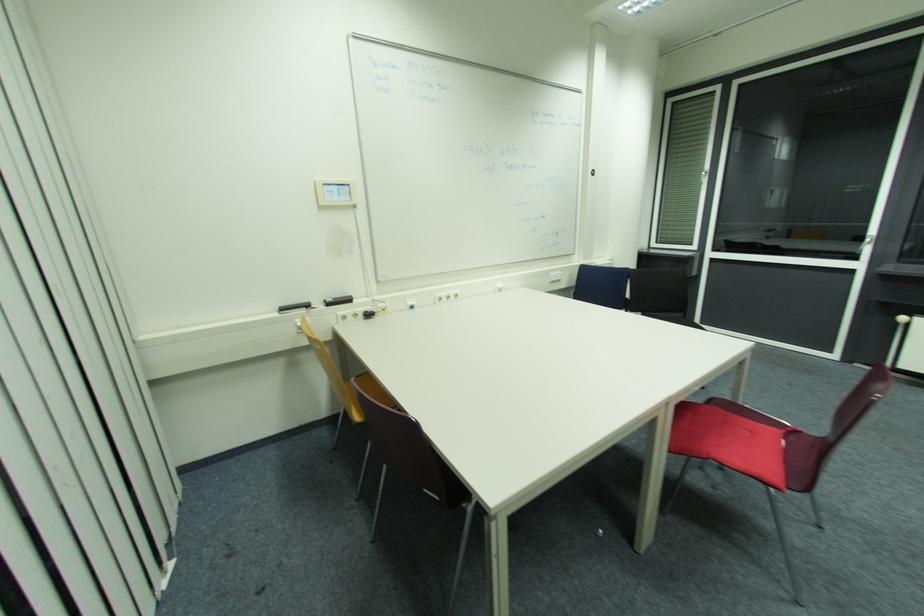
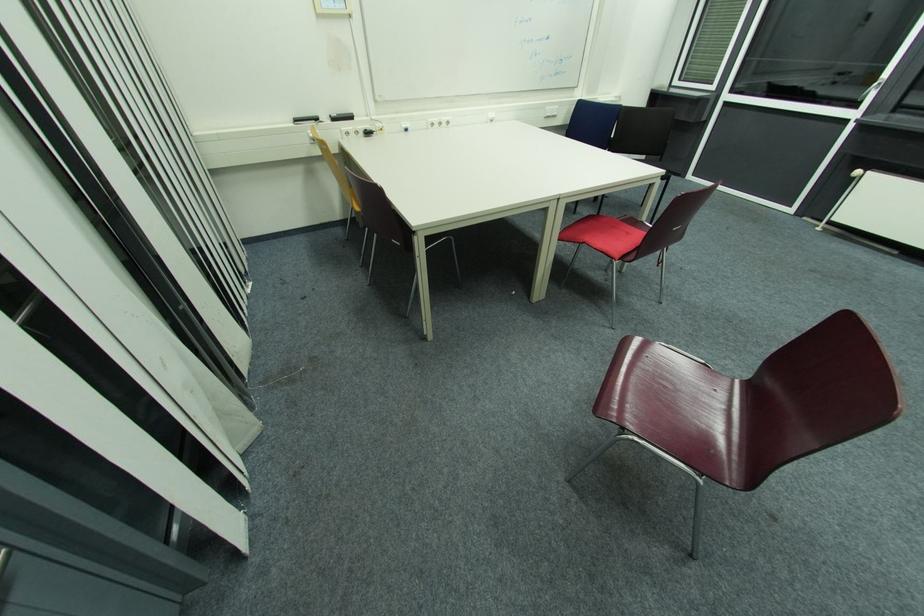
The point at (332, 306) is marked in the first image. Where is the corresponding point in the second image?

(337, 121)